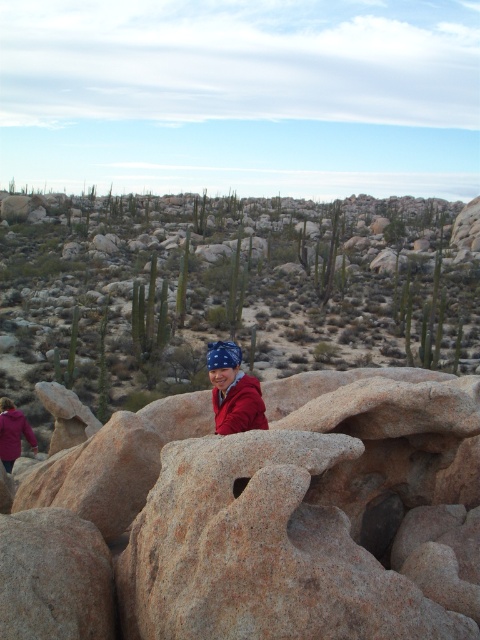
You are a photographer trying to capture the brown rough rock at center and the matte red jacket at center in the same frame. Based on their sizes, which one will appear larger in the photo?

The brown rough rock at center will appear larger in the photo since it has a greater height compared to the matte red jacket at center.

You are a hiker who wants to place a small GPS marker between the brown rough rock at center and the matte red jacket at center. The GPS marker requires a space of 1 meter between the two objects to function properly. Can you place it there?

The brown rough rock at center and matte red jacket at center are 1.44 meters apart, which is more than the required 1 meter, so yes you can place the GPS marker between them.